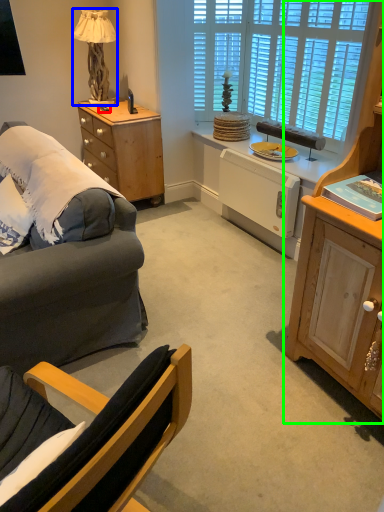
Question: Considering the real-world distances, which object is farthest from remote control (highlighted by a red box)? lamp (highlighted by a blue box) or cabinetry (highlighted by a green box)?

Choices:
 (A) lamp
 (B) cabinetry

Answer: (B)